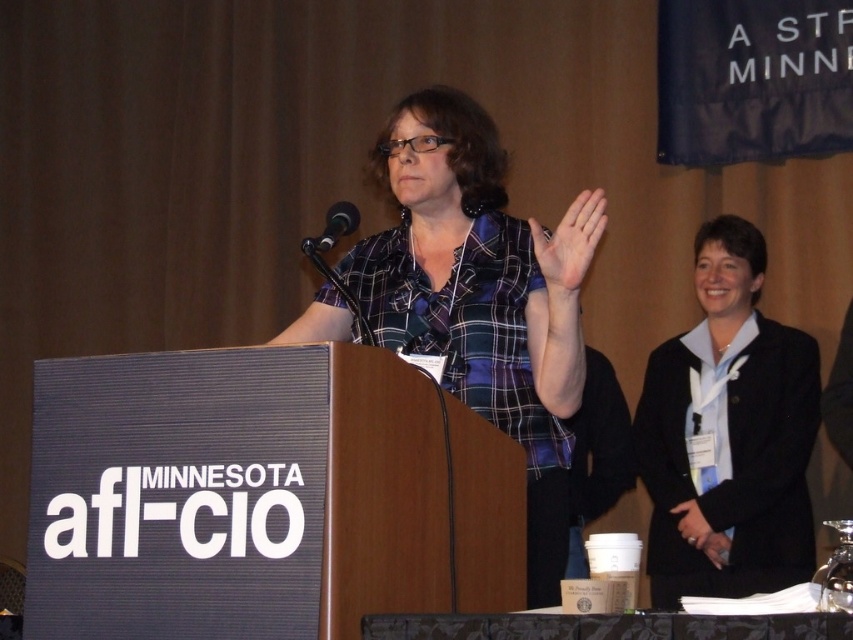
Based on the photo, who is lower down, black matte blazer at right or black fabric table at lower center?

black fabric table at lower center is lower down.

Is point (735, 538) closer to camera compared to point (767, 634)?

No, it is not.

Identify the location of black matte blazer at right. This screenshot has width=853, height=640. (728, 435).

This screenshot has height=640, width=853. Find the location of `black matte blazer at right`. black matte blazer at right is located at coordinates (728, 435).

Does black matte blazer at right appear under black plastic microphone at upper center?

Indeed, black matte blazer at right is positioned under black plastic microphone at upper center.

Is point (664, 417) less distant than point (316, 256)?

No, it is not.

Identify the location of black matte blazer at right. (728, 435).

Does plaid fabric shirt at center appear over black plastic microphone at upper center?

Incorrect, plaid fabric shirt at center is not positioned above black plastic microphone at upper center.

Where is `plaid fabric shirt at center`? Image resolution: width=853 pixels, height=640 pixels. plaid fabric shirt at center is located at coordinates [482, 296].